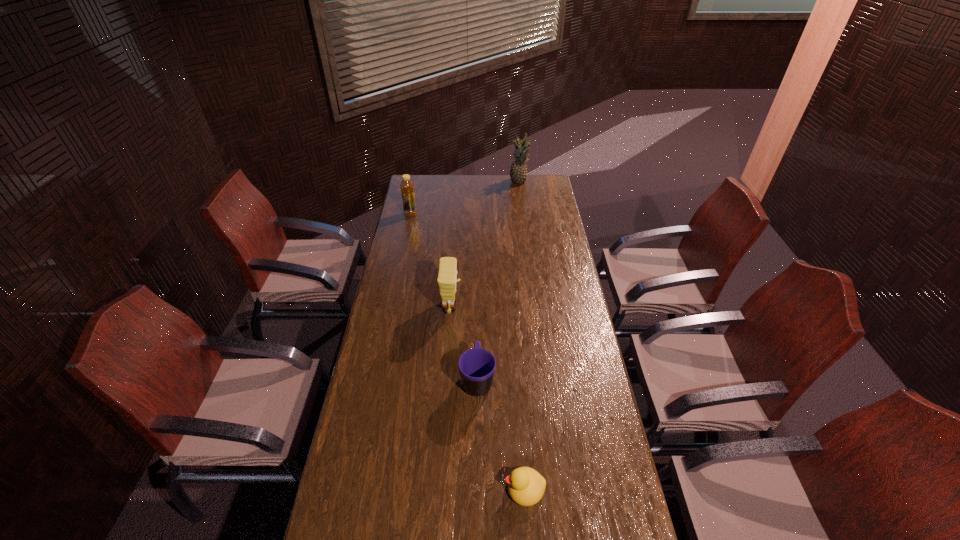
The image size is (960, 540). What are the coordinates of `vacant space located on the left of the pineapple` in the screenshot? It's located at (458, 182).

Find the location of a particular element. free spot located 0.170m on the back of the bottle is located at coordinates (415, 194).

Where is `vacant region located on the face of the fourth object from right to left`? The width and height of the screenshot is (960, 540). vacant region located on the face of the fourth object from right to left is located at coordinates (554, 306).

The width and height of the screenshot is (960, 540). I want to click on blank area located with the handle on the side of the second shortest object, so click(x=477, y=345).

The width and height of the screenshot is (960, 540). In order to click on vacant space located 0.370m with the handle on the side of the second shortest object in this screenshot , I will do `click(478, 290)`.

The width and height of the screenshot is (960, 540). In order to click on blank area located with the handle on the side of the second shortest object in this screenshot , I will do `click(478, 288)`.

I want to click on blank space located 0.260m on the face of the shortest object, so click(415, 489).

I want to click on vacant area situated 0.220m on the face of the shortest object, so click(428, 489).

Locate an element on the screen. This screenshot has width=960, height=540. vacant area situated on the face of the shortest object is located at coordinates (463, 489).

Locate an element on the screen. object at the far edge is located at coordinates 518,173.